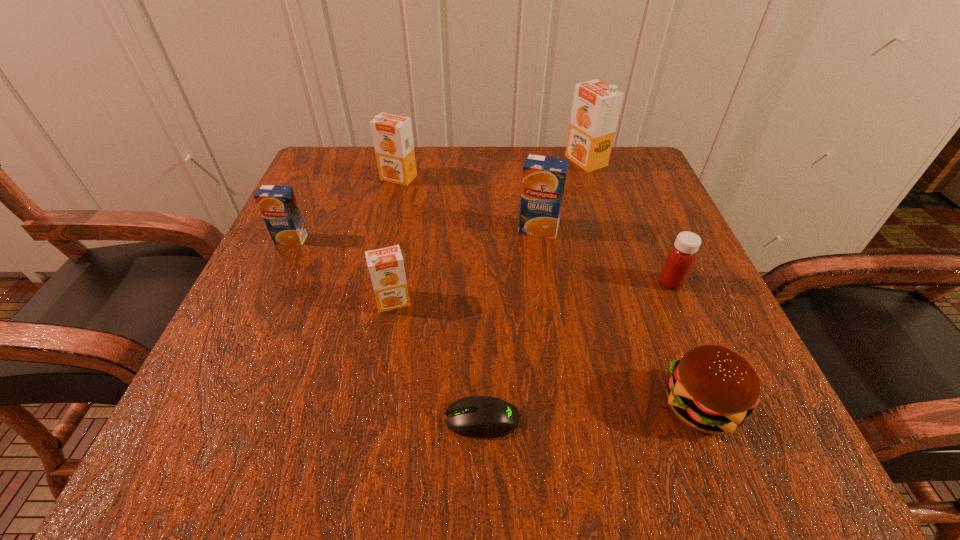
Find the location of `brown hamburger`. brown hamburger is located at coordinates (712, 389).

Identify the location of the fourth object from left to right. (476, 416).

The image size is (960, 540). I want to click on gray computer mouse, so click(476, 416).

Identify the location of vacant space located on the right of the tallest object. (x=627, y=161).

Identify the location of vacant space positioned on the front of the bigger blue orange_juice. This screenshot has width=960, height=540. pyautogui.click(x=550, y=308).

Find the location of a particular element. The height and width of the screenshot is (540, 960). vacant area situated on the left of the second biggest orange orange juice is located at coordinates (340, 178).

You are a GUI agent. You are given a task and a screenshot of the screen. Output one action in this format:
    pyautogui.click(x=<x>, y=<y>)
    Task: Click on the free space located 0.360m on the right of the leftmost object
    This screenshot has height=540, width=960.
    Given the screenshot: What is the action you would take?
    497,239

Where is `free space located 0.060m on the right of the smallest orange orange juice`? free space located 0.060m on the right of the smallest orange orange juice is located at coordinates (448, 301).

Identify the location of vacant position located on the left of the medicine. (530, 282).

Find the location of a particular element. The height and width of the screenshot is (540, 960). vacant space located 0.130m on the back of the brown hamburger is located at coordinates (660, 302).